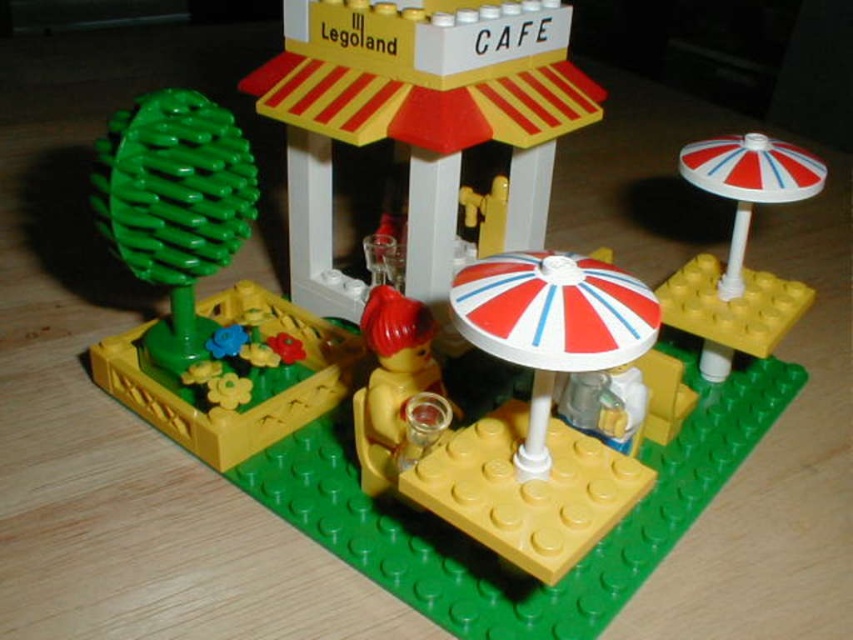
Question: Which object is the farthest from the white striped umbrella at upper right?

Choices:
 (A) white plastic building at center
 (B) smooth yellow cup at center

Answer: (B)

Question: Considering the real-world distances, which object is farthest from the white striped umbrella at upper right?

Choices:
 (A) white striped umbrella at center
 (B) white plastic building at center

Answer: (A)

Question: Among these objects, which one is nearest to the camera?

Choices:
 (A) smooth yellow cup at center
 (B) white striped umbrella at center

Answer: (B)

Question: Is white striped umbrella at center positioned at the back of white striped umbrella at upper right?

Choices:
 (A) no
 (B) yes

Answer: (A)

Question: Is white plastic building at center smaller than smooth yellow cup at center?

Choices:
 (A) yes
 (B) no

Answer: (B)

Question: Does white plastic building at center have a larger size compared to white striped umbrella at center?

Choices:
 (A) yes
 (B) no

Answer: (A)